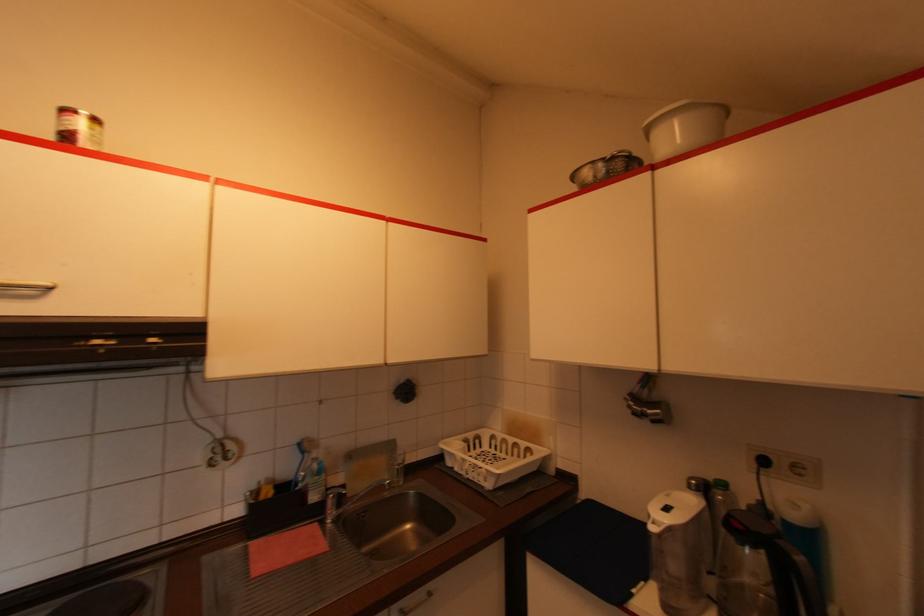
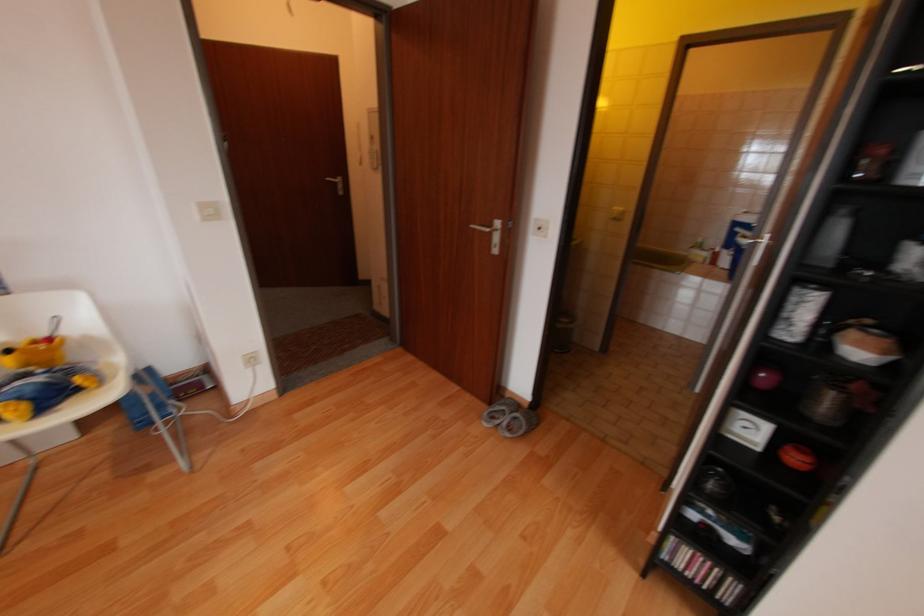
Question: Which direction would the cameraman need to move to produce the second image? Reply with the corresponding letter.

Choices:
 (A) Left
 (B) Right
 (C) Forward
 (D) Backward

Answer: (A)